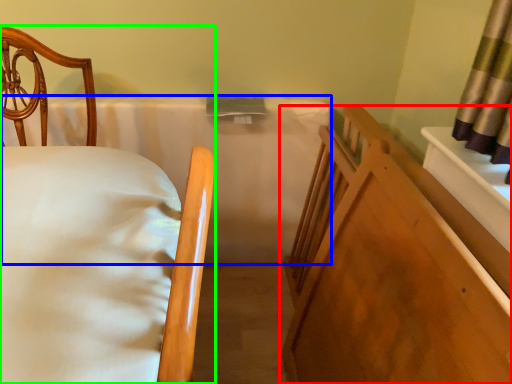
Question: Based on their relative distances, which object is farther from furniture (highlighted by a red box)? Choose from mattress (highlighted by a blue box) and bed (highlighted by a green box).

Choices:
 (A) mattress
 (B) bed

Answer: (A)